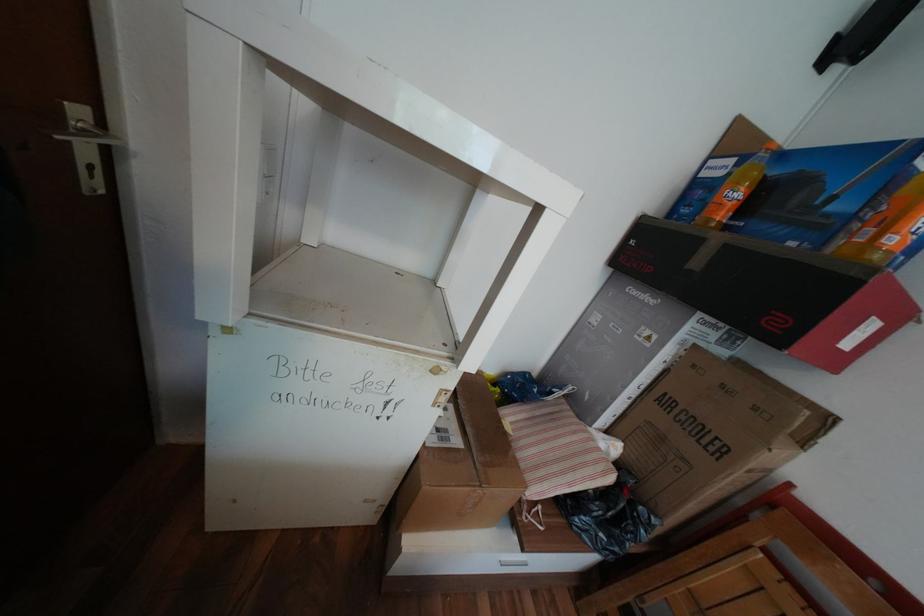
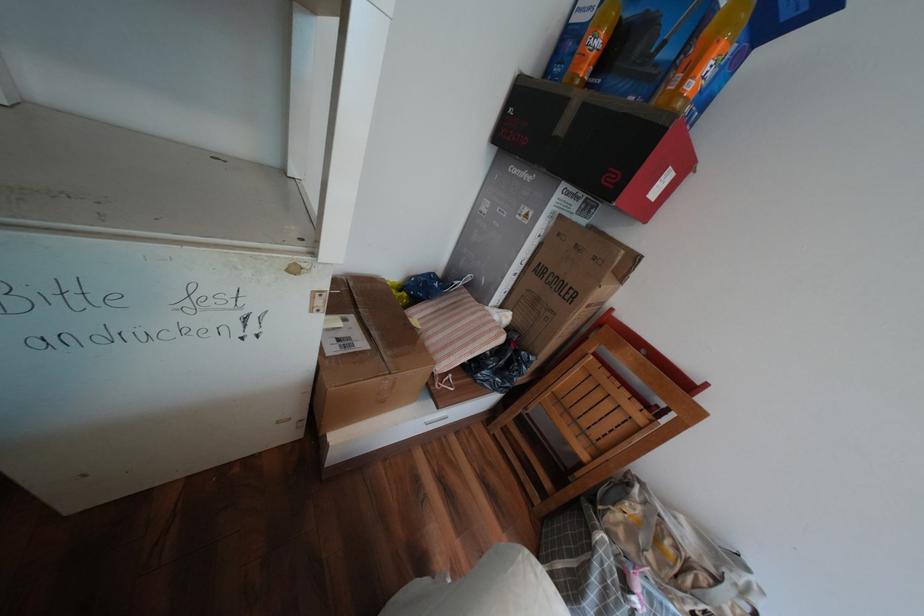
Question: In a continuous first-person perspective shot, in which direction is the camera moving?

Choices:
 (A) Left
 (B) Right
 (C) Forward
 (D) Backward

Answer: (B)